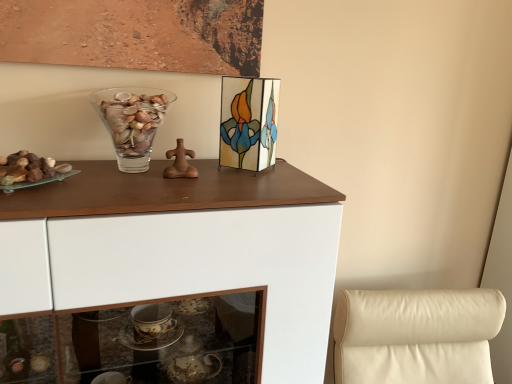
Locate an element on the screen. stained glass picture frame at upper center is located at coordinates (249, 122).

In order to click on transparent glass vase at upper center in this screenshot , I will do `click(132, 122)`.

Would you say translucent glass rocks at left is a long distance from white glossy cabinet at upper center?

No, translucent glass rocks at left is not far away from white glossy cabinet at upper center.

How distant is translucent glass rocks at left from white glossy cabinet at upper center?

translucent glass rocks at left and white glossy cabinet at upper center are 13.39 inches apart.

From a real-world perspective, is translucent glass rocks at left physically located above or below white glossy cabinet at upper center?

translucent glass rocks at left is above white glossy cabinet at upper center.

Does point (37, 179) come closer to viewer compared to point (271, 279)?

That is True.

Does stained glass picture frame at upper center have a lesser width compared to translucent glass rocks at left?

Indeed, stained glass picture frame at upper center has a lesser width compared to translucent glass rocks at left.

Is there a large distance between stained glass picture frame at upper center and translucent glass rocks at left?

That's not correct — stained glass picture frame at upper center is a little close to translucent glass rocks at left.

Does stained glass picture frame at upper center have a larger size compared to translucent glass rocks at left?

Yes, stained glass picture frame at upper center is bigger than translucent glass rocks at left.

Consider the image. Relative to translucent glass rocks at left, is stained glass picture frame at upper center in front or behind?

Clearly, stained glass picture frame at upper center is behind translucent glass rocks at left.

Which is less distant, (x=149, y=101) or (x=316, y=368)?

The point (x=149, y=101) is more forward.

Is transparent glass vase at upper center looking in the opposite direction of white glossy cabinet at upper center?

transparent glass vase at upper center does not have its back to white glossy cabinet at upper center.

Measure the distance from transparent glass vase at upper center to white glossy cabinet at upper center.

transparent glass vase at upper center and white glossy cabinet at upper center are 28.75 centimeters apart.

Does transparent glass vase at upper center have a larger size compared to white glossy cabinet at upper center?

Incorrect, transparent glass vase at upper center is not larger than white glossy cabinet at upper center.

From the picture: Considering the relative sizes of white glossy cabinet at upper center and stained glass picture frame at upper center in the image provided, is white glossy cabinet at upper center taller than stained glass picture frame at upper center?

Indeed, white glossy cabinet at upper center has a greater height compared to stained glass picture frame at upper center.

Is white glossy cabinet at upper center aimed at stained glass picture frame at upper center?

No, white glossy cabinet at upper center is not turned towards stained glass picture frame at upper center.

Based on their positions, is white glossy cabinet at upper center located to the left or right of stained glass picture frame at upper center?

white glossy cabinet at upper center is to the left of stained glass picture frame at upper center.

From the image's perspective, does white glossy cabinet at upper center appear lower than stained glass picture frame at upper center?

Indeed, from the image's perspective, white glossy cabinet at upper center is shown beneath stained glass picture frame at upper center.

Would you say stained glass picture frame at upper center is to the left or to the right of transparent glass vase at upper center in the picture?

Based on their positions, stained glass picture frame at upper center is located to the right of transparent glass vase at upper center.

Is stained glass picture frame at upper center behind transparent glass vase at upper center?

Yes, stained glass picture frame at upper center is behind transparent glass vase at upper center.

Considering the positions of point (254, 99) and point (169, 102), is point (254, 99) closer or farther from the camera than point (169, 102)?

Point (254, 99).

From the picture: From the image's perspective, relative to transparent glass vase at upper center, is stained glass picture frame at upper center above or below?

stained glass picture frame at upper center is situated higher than transparent glass vase at upper center in the image.

Find the location of a particular element. This screenshot has height=384, width=512. vase below the stained glass picture frame at upper center (from a real-world perspective) is located at coordinates (132, 122).

Which point is more distant from viewer, (126, 152) or (268, 140)?

The point (268, 140) is more distant.

How many degrees apart are the facing directions of transparent glass vase at upper center and stained glass picture frame at upper center?

There is a 47.1-degree angle between the facing directions of transparent glass vase at upper center and stained glass picture frame at upper center.

Considering the sizes of objects translucent glass rocks at left and transparent glass vase at upper center in the image provided, who is smaller, translucent glass rocks at left or transparent glass vase at upper center?

translucent glass rocks at left is smaller.

Is translucent glass rocks at left far away from transparent glass vase at upper center?

That's not correct — translucent glass rocks at left is a little close to transparent glass vase at upper center.

Considering the points (2, 184) and (123, 120), which point is in front, point (2, 184) or point (123, 120)?

The point (2, 184) is more forward.

Measure the distance between translucent glass rocks at left and transparent glass vase at upper center.

A distance of 7.85 inches exists between translucent glass rocks at left and transparent glass vase at upper center.

Where is `cabinetry below the translucent glass rocks at left (from a real-world perspective)`? The height and width of the screenshot is (384, 512). cabinetry below the translucent glass rocks at left (from a real-world perspective) is located at coordinates (180, 249).

In order to click on stuff that appears in front of the stained glass picture frame at upper center in this screenshot , I will do `click(29, 168)`.

When comparing their distances from transparent glass vase at upper center, does stained glass picture frame at upper center or translucent glass rocks at left seem further?

stained glass picture frame at upper center lies further to transparent glass vase at upper center than the other object.

Considering their positions, is translucent glass rocks at left positioned closer to transparent glass vase at upper center than stained glass picture frame at upper center?

translucent glass rocks at left is closer to transparent glass vase at upper center.

From the image, which object appears to be farther from translucent glass rocks at left, stained glass picture frame at upper center or white glossy cabinet at upper center?

stained glass picture frame at upper center is positioned further to the anchor translucent glass rocks at left.

Considering their positions, is white glossy cabinet at upper center positioned closer to stained glass picture frame at upper center than translucent glass rocks at left?

Among the two, white glossy cabinet at upper center is located nearer to stained glass picture frame at upper center.

From the image, which object appears to be farther from white glossy cabinet at upper center, stained glass picture frame at upper center or transparent glass vase at upper center?

transparent glass vase at upper center lies further to white glossy cabinet at upper center than the other object.

Estimate the real-world distances between objects in this image. Which object is further from translucent glass rocks at left, white glossy cabinet at upper center or transparent glass vase at upper center?

white glossy cabinet at upper center is further to translucent glass rocks at left.

Based on their spatial positions, is translucent glass rocks at left or white glossy cabinet at upper center further from stained glass picture frame at upper center?

Based on the image, translucent glass rocks at left appears to be further to stained glass picture frame at upper center.

From the image, which object appears to be farther from transparent glass vase at upper center, translucent glass rocks at left or white glossy cabinet at upper center?

white glossy cabinet at upper center is positioned further to the anchor transparent glass vase at upper center.

Image resolution: width=512 pixels, height=384 pixels. Identify the location of vase between translucent glass rocks at left and stained glass picture frame at upper center from left to right. (132, 122).

The height and width of the screenshot is (384, 512). I want to click on stuff between stained glass picture frame at upper center and white glossy cabinet at upper center in the up-down direction, so click(29, 168).

The image size is (512, 384). I want to click on stuff between transparent glass vase at upper center and white glossy cabinet at upper center from top to bottom, so click(x=29, y=168).

The image size is (512, 384). Identify the location of vase between stained glass picture frame at upper center and white glossy cabinet at upper center in the up-down direction. (132, 122).